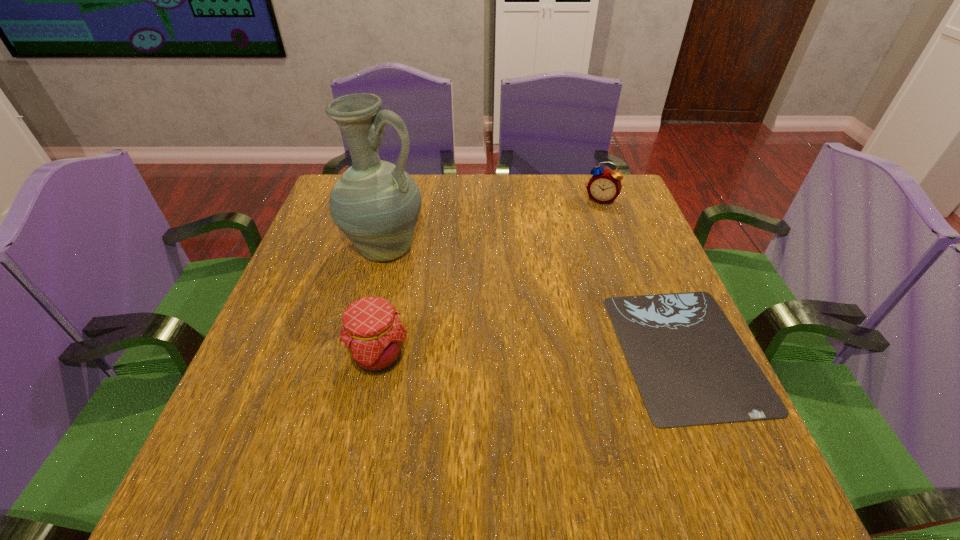
Image resolution: width=960 pixels, height=540 pixels. Identify the location of vacant space at the far edge of the desktop. (524, 211).

What are the coordinates of `free location at the near edge` in the screenshot? It's located at (574, 411).

Image resolution: width=960 pixels, height=540 pixels. I want to click on vacant region at the left edge, so 290,275.

The width and height of the screenshot is (960, 540). Identify the location of free region at the right edge. (627, 242).

Locate an element on the screen. The width and height of the screenshot is (960, 540). vacant space at the near left corner of the desktop is located at coordinates (287, 397).

Where is `vacant space that is in between the shortest object and the third nearest object`? The image size is (960, 540). vacant space that is in between the shortest object and the third nearest object is located at coordinates (536, 300).

Identify the location of free space between the mousepad and the alarm clock. This screenshot has height=540, width=960. click(643, 275).

Locate an element on the screen. Image resolution: width=960 pixels, height=540 pixels. vacant area that lies between the farthest object and the jam is located at coordinates (490, 279).

Locate an element on the screen. empty space between the farthest object and the shortest object is located at coordinates (643, 275).

The image size is (960, 540). Find the location of `free space between the mousepad and the jam`. free space between the mousepad and the jam is located at coordinates (532, 354).